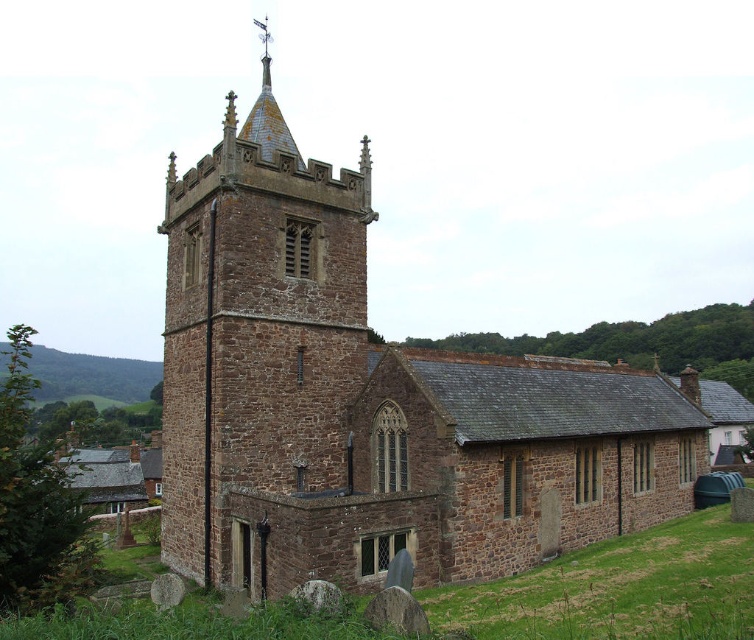
Who is lower down, brown stone tower at center-left or brown grassy at lower right?

brown grassy at lower right

Between point (314, 403) and point (198, 618), which one is positioned in front?

Point (198, 618) is in front.

At what (x,y) coordinates should I click in order to perform the action: click on brown stone tower at center-left. Please return your answer as a coordinate pair (x, y). The width and height of the screenshot is (754, 640). Looking at the image, I should click on (259, 349).

Who is lower down, brown stone church at center or brown stone tower at center-left?

Positioned lower is brown stone church at center.

Measure the distance between point (510, 392) and camera.

They are 53.53 meters apart.

Between point (231, 170) and point (345, 442), which one is positioned in front?

Point (231, 170)

Where is `brown stone church at center`? This screenshot has height=640, width=754. brown stone church at center is located at coordinates (372, 401).

Between brown stone church at center and brown grassy at lower right, which one is positioned higher?

Positioned higher is brown stone church at center.

Is point (277, 346) behind point (497, 580)?

Yes, point (277, 346) is behind point (497, 580).

Locate an element on the screen. brown stone church at center is located at coordinates (372, 401).